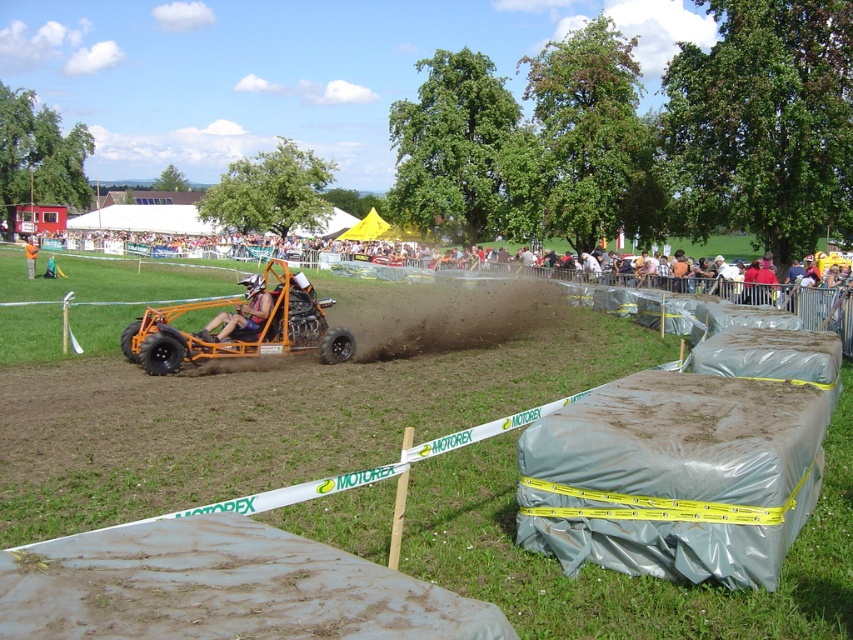
Question: Is gray plastic barrier at center wider than orange matte/rough monster truck at center?

Choices:
 (A) yes
 (B) no

Answer: (A)

Question: Can you confirm if orange metallic go-kart at center is positioned to the right of orange matte go-kart at center?

Choices:
 (A) no
 (B) yes

Answer: (A)

Question: Is orange matte/rough monster truck at center smaller than orange metallic go-kart at center?

Choices:
 (A) yes
 (B) no

Answer: (A)

Question: Which object is positioned farthest from the gray plastic barrier at center?

Choices:
 (A) orange metallic go-kart at center
 (B) orange matte/rough monster truck at center
 (C) orange fabric person at center

Answer: (C)

Question: Among these objects, which one is nearest to the camera?

Choices:
 (A) orange matte/rough monster truck at center
 (B) orange matte go-kart at center

Answer: (A)

Question: Based on their relative distances, which object is farther from the orange fabric person at center?

Choices:
 (A) orange metallic go-kart at center
 (B) gray plastic barrier at center
 (C) orange matte/rough monster truck at center

Answer: (C)